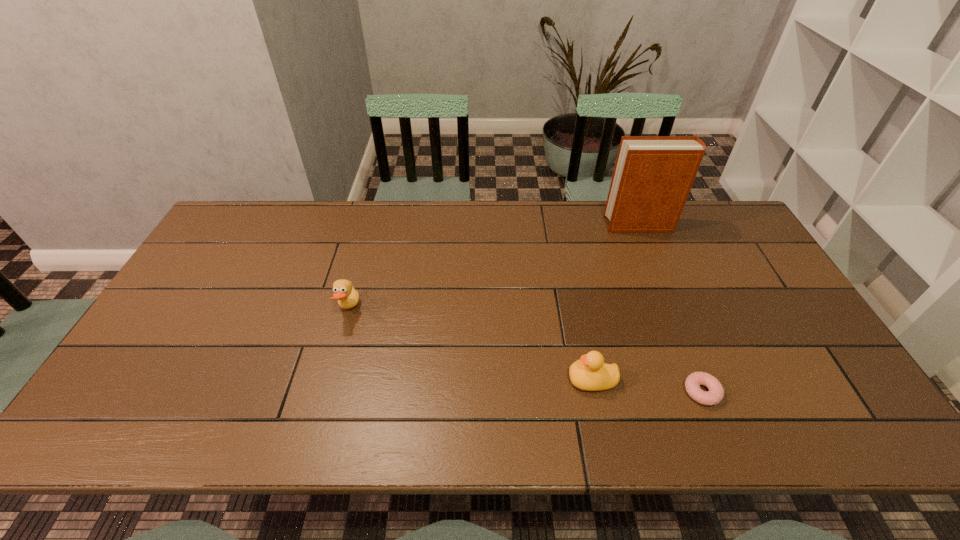
Find the location of a particular element. free space between the tallest object and the nearer duck is located at coordinates (615, 302).

Locate an element on the screen. free spot between the left duck and the farthest object is located at coordinates (494, 267).

I want to click on free space between the leftmost object and the right duck, so click(470, 345).

Select which object appears as the second closest to the tallest object. Please provide its 2D coordinates. Your answer should be formatted as a tuple, i.e. [(x, y)], where the tuple contains the x and y coordinates of a point satisfying the conditions above.

[(715, 395)]

Where is `the second closest object to the tallest object`? This screenshot has width=960, height=540. the second closest object to the tallest object is located at coordinates (715, 395).

Locate an element on the screen. The height and width of the screenshot is (540, 960). blank space that satisfies the following two spatial constraints: 1. on the face of the doughnut; 2. on the left side of the second object from left to right is located at coordinates (594, 392).

Where is `vacant space that satisfies the following two spatial constraints: 1. on the open cover of the tallest object; 2. on the front side of the shortest object`? The width and height of the screenshot is (960, 540). vacant space that satisfies the following two spatial constraints: 1. on the open cover of the tallest object; 2. on the front side of the shortest object is located at coordinates (708, 392).

The width and height of the screenshot is (960, 540). Identify the location of vacant region that satisfies the following two spatial constraints: 1. on the open cover of the tallest object; 2. on the front side of the doughnut. (708, 392).

Identify the location of free spot that satisfies the following two spatial constraints: 1. on the beak of the farther duck; 2. on the right side of the shortest object. The image size is (960, 540). (326, 392).